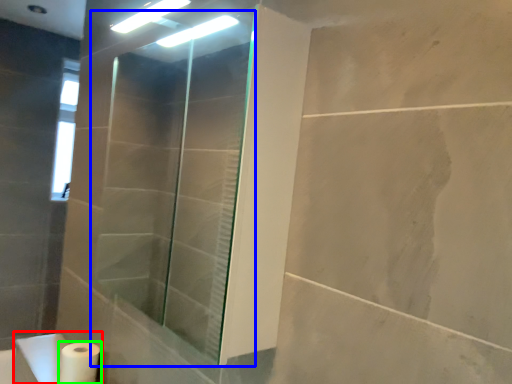
Question: Which object is positioned closest to sink (highlighted by a red box)? Select from shower door (highlighted by a blue box) and toilet paper (highlighted by a green box).

Choices:
 (A) shower door
 (B) toilet paper

Answer: (B)